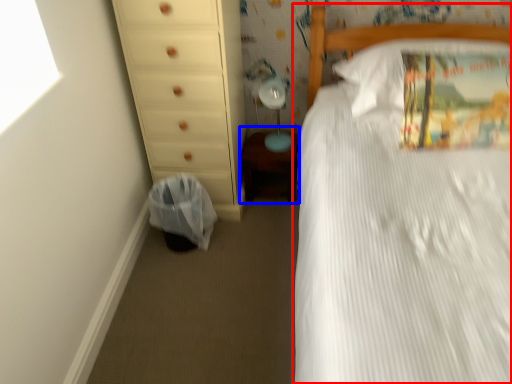
Question: Which of the following is the farthest to the observer, bed (highlighted by a red box) or changing table (highlighted by a blue box)?

Choices:
 (A) bed
 (B) changing table

Answer: (B)